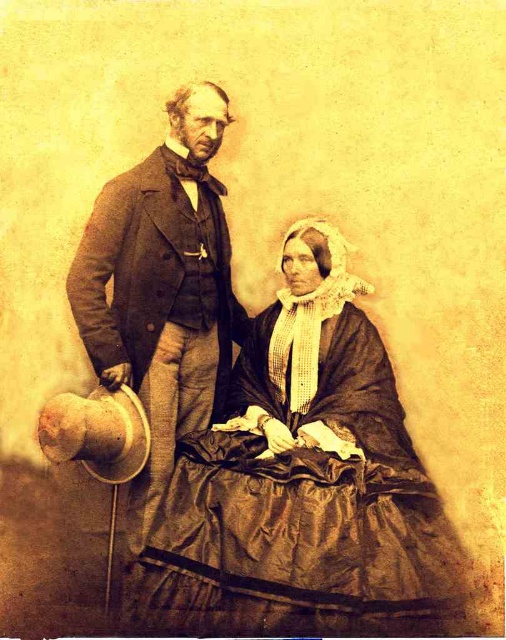
Question: Does matte black dress at center lie in front of matte brown suit at upper left?

Choices:
 (A) yes
 (B) no

Answer: (A)

Question: Where is matte black dress at center located in relation to matte brown suit at upper left in the image?

Choices:
 (A) below
 (B) above

Answer: (A)

Question: Which point is closer to the camera taking this photo?

Choices:
 (A) (194, 106)
 (B) (268, 548)

Answer: (B)

Question: Which point appears closest to the camera in this image?

Choices:
 (A) (315, 269)
 (B) (219, 122)

Answer: (B)

Question: Does matte black dress at center appear on the right side of matte brown suit at upper left?

Choices:
 (A) no
 (B) yes

Answer: (B)

Question: Which point appears farthest from the camera in this image?

Choices:
 (A) (369, 440)
 (B) (145, 214)

Answer: (B)